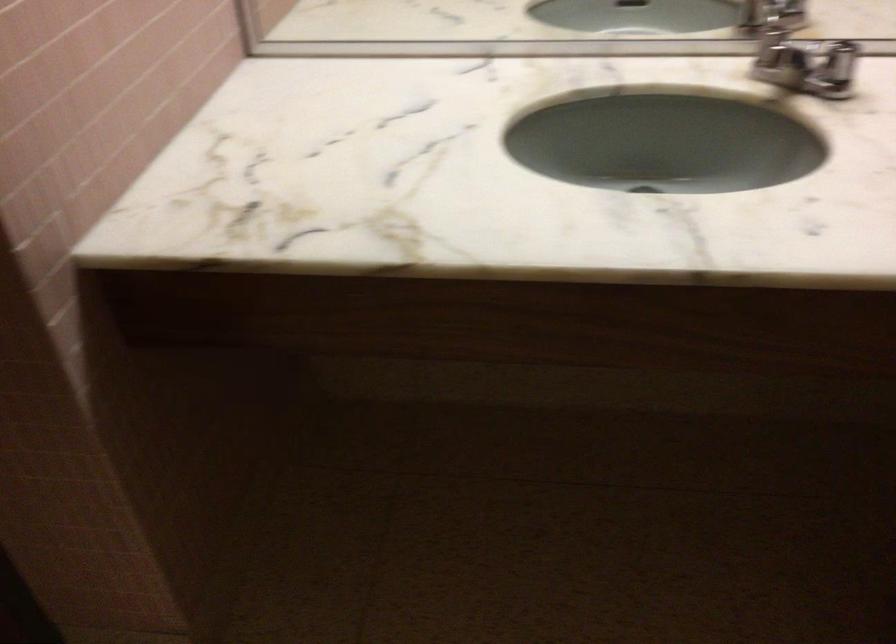
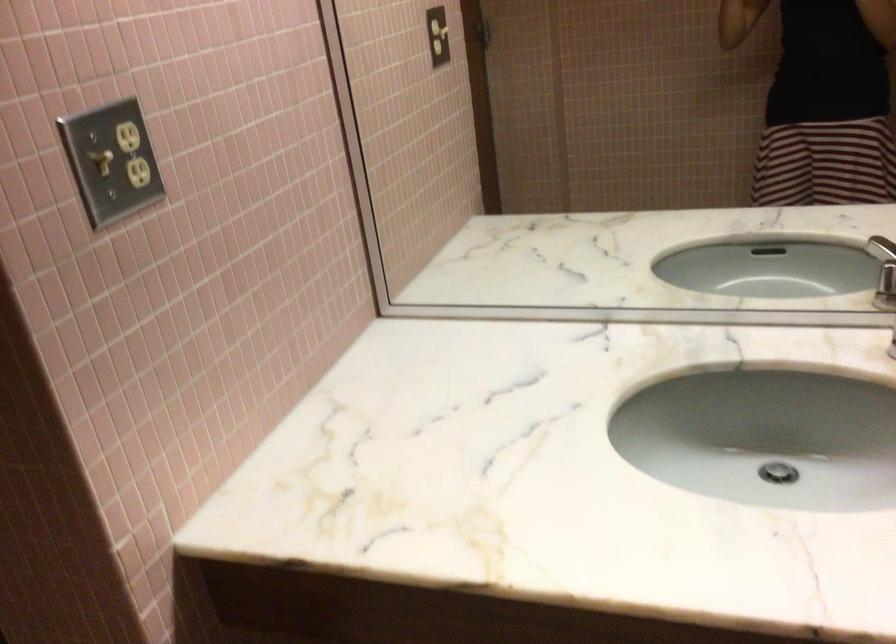
Question: The images are taken continuously from a first-person perspective. In which direction are you moving?

Choices:
 (A) Left
 (B) Right
 (C) Forward
 (D) Backward

Answer: (B)